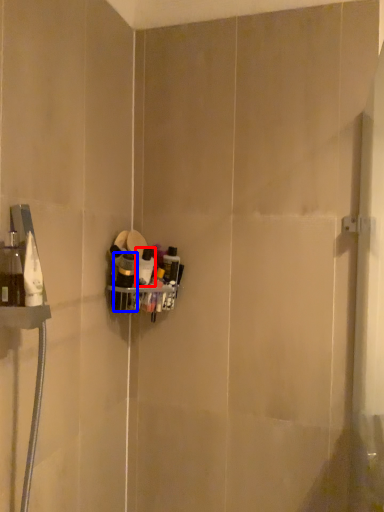
Question: Which object appears farthest to the camera in this image, toiletry (highlighted by a red box) or toiletry (highlighted by a blue box)?

Choices:
 (A) toiletry
 (B) toiletry

Answer: (A)